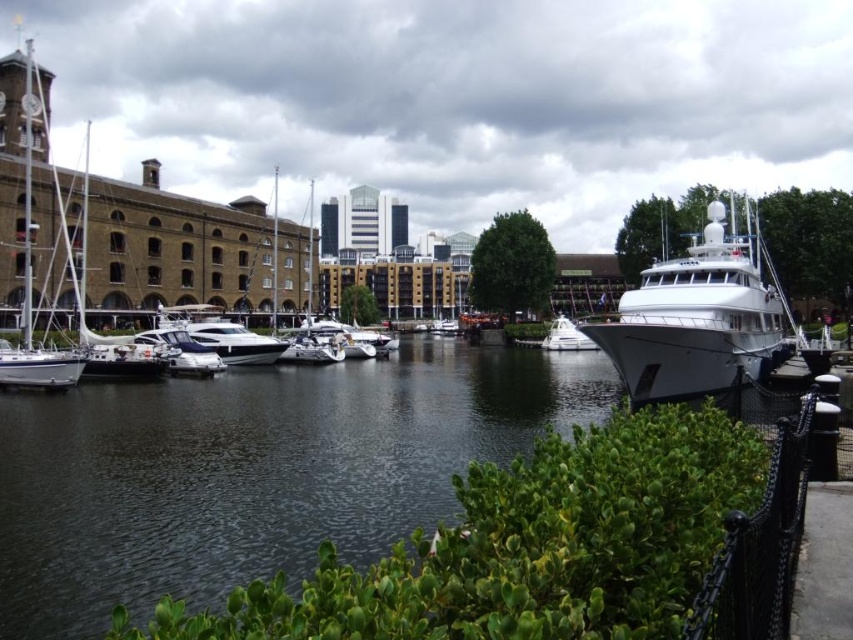
Question: Among these points, which one is farthest from the camera?

Choices:
 (A) (22, 340)
 (B) (172, 515)
 (C) (242, 356)
 (D) (325, 355)

Answer: (D)

Question: Does white glossy yacht at right have a lesser width compared to shiny white yacht at center?

Choices:
 (A) no
 (B) yes

Answer: (A)

Question: Estimate the real-world distances between objects in this image. Which object is farther from the white glossy sailboat at center?

Choices:
 (A) white glossy yacht at right
 (B) dark blue water at center
 (C) white glossy boat at center
 (D) white glossy sailboat at left

Answer: (D)

Question: Is shiny white yacht at center closer to the viewer compared to white glossy boat at center?

Choices:
 (A) yes
 (B) no

Answer: (B)

Question: Considering the real-world distances, which object is farthest from the dark blue water at center?

Choices:
 (A) white glossy sailboat at left
 (B) white glossy boat at center
 (C) white glossy yacht at right

Answer: (A)

Question: Is dark blue water at center positioned in front of white glossy sailboat at center?

Choices:
 (A) no
 (B) yes

Answer: (B)